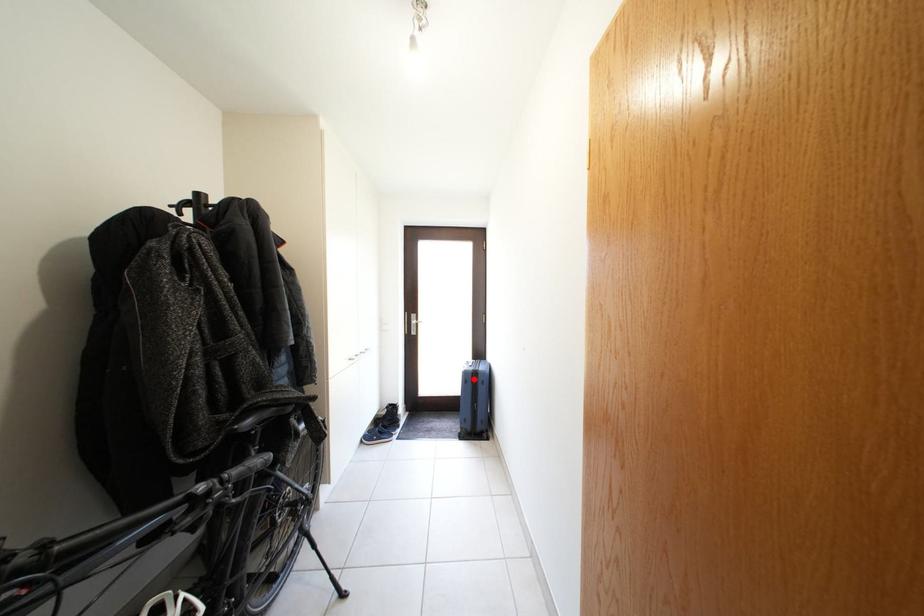
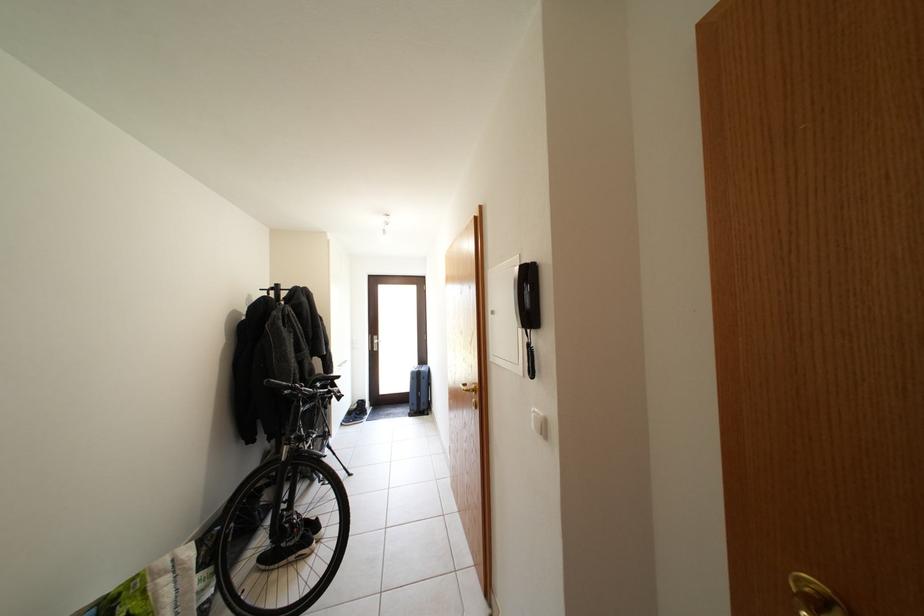
The point at the highlighted location is marked in the first image. Where is the corresponding point in the second image?

(420, 379)